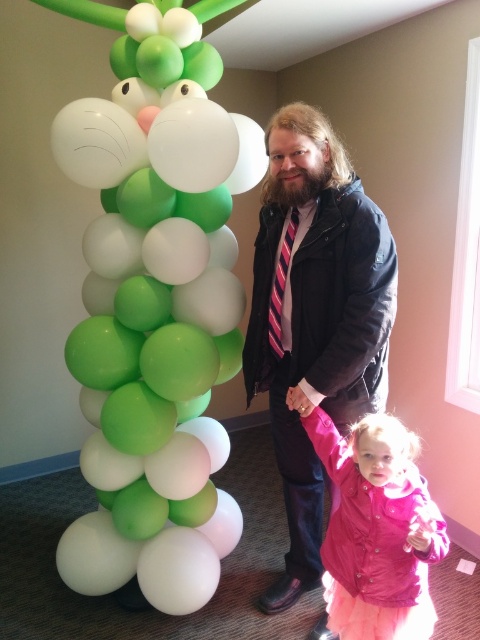
You are at a party and see the green matte balloon column at left and the striped fabric tie at center. Which object is located to the left of the other?

The green matte balloon column at left is positioned on the left side of striped fabric tie at center.